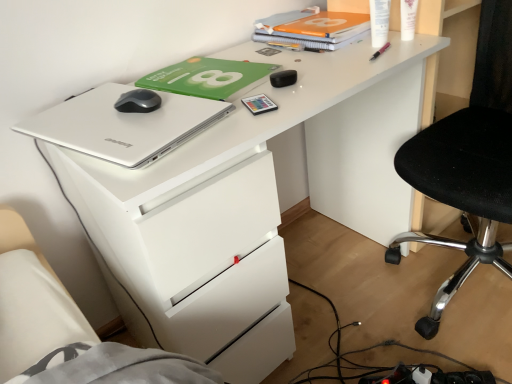
What are the coordinates of `free space between green matte paperback book at upper center and pink plastic pen at upper right, the 3th stationery positioned from the left` in the screenshot? It's located at (310, 62).